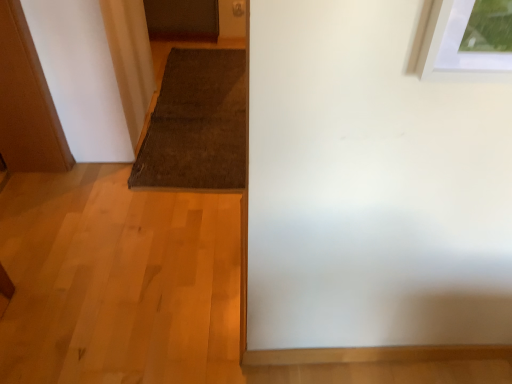
Question: In the image, is brown textured mat at center positioned in front of or behind wooden door at left?

Choices:
 (A) behind
 (B) front

Answer: (A)

Question: Considering the relative positions of brown textured mat at center and wooden door at left in the image provided, is brown textured mat at center to the left or to the right of wooden door at left?

Choices:
 (A) left
 (B) right

Answer: (B)

Question: Considering the positions of point (173, 52) and point (13, 36), is point (173, 52) closer or farther from the camera than point (13, 36)?

Choices:
 (A) farther
 (B) closer

Answer: (A)

Question: From the image's perspective, is wooden door at left above or below brown textured mat at center?

Choices:
 (A) above
 (B) below

Answer: (B)

Question: Does point (52, 99) appear closer or farther from the camera than point (238, 109)?

Choices:
 (A) farther
 (B) closer

Answer: (B)

Question: Is wooden door at left taller or shorter than brown textured mat at center?

Choices:
 (A) tall
 (B) short

Answer: (A)

Question: Is wooden door at left spatially inside brown textured mat at center, or outside of it?

Choices:
 (A) inside
 (B) outside

Answer: (B)